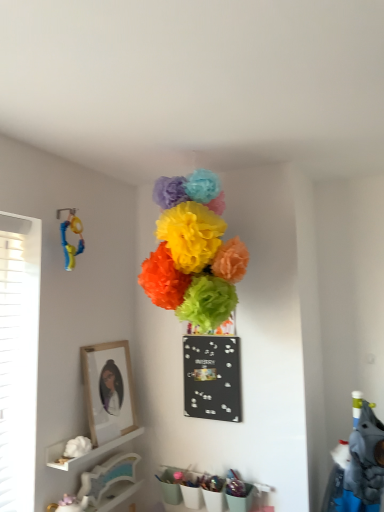
Question: Does black matte bulletin board at center have a greater width compared to wooden framed portrait at left?

Choices:
 (A) yes
 (B) no

Answer: (B)

Question: Is black matte bulletin board at center aimed at wooden framed portrait at left?

Choices:
 (A) no
 (B) yes

Answer: (A)

Question: From a real-world perspective, is black matte bulletin board at center over wooden framed portrait at left?

Choices:
 (A) yes
 (B) no

Answer: (A)

Question: From the image's perspective, is black matte bulletin board at center beneath wooden framed portrait at left?

Choices:
 (A) yes
 (B) no

Answer: (B)

Question: Does black matte bulletin board at center lie behind wooden framed portrait at left?

Choices:
 (A) no
 (B) yes

Answer: (B)

Question: From a real-world perspective, is black matte bulletin board at center below wooden framed portrait at left?

Choices:
 (A) yes
 (B) no

Answer: (B)

Question: Can you confirm if white matte flower at lower left, the 1th flower when ordered from bottom to top, is taller than wooden framed portrait at left?

Choices:
 (A) yes
 (B) no

Answer: (B)

Question: Does white matte flower at lower left, the third flower when ordered from top to bottom, have a lesser width compared to wooden framed portrait at left?

Choices:
 (A) yes
 (B) no

Answer: (B)

Question: Can you confirm if white matte flower at lower left, which appears as the 3th flower when viewed from the right, is bigger than wooden framed portrait at left?

Choices:
 (A) no
 (B) yes

Answer: (A)

Question: Is white matte flower at lower left, which appears as the 1th flower when viewed from the left, facing away from wooden framed portrait at left?

Choices:
 (A) yes
 (B) no

Answer: (B)

Question: Does white matte flower at lower left, which appears as the 1th flower when viewed from the left, have a smaller size compared to wooden framed portrait at left?

Choices:
 (A) yes
 (B) no

Answer: (A)

Question: Is white matte flower at lower left, which appears as the 3th flower when viewed from the right, at the left side of wooden framed portrait at left?

Choices:
 (A) yes
 (B) no

Answer: (A)

Question: Is bright tissue paper flowers at center, the first flower viewed from the top, facing away from white glossy shelf at lower left?

Choices:
 (A) yes
 (B) no

Answer: (B)